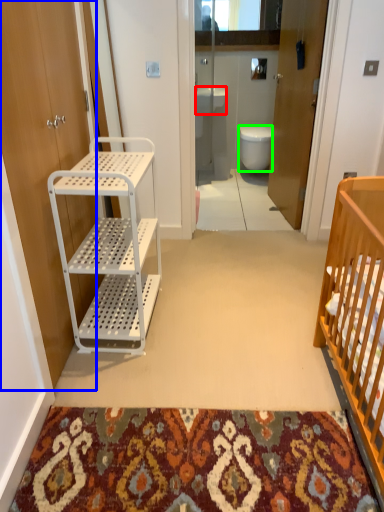
Question: Considering the real-world distances, which object is closest to sink (highlighted by a red box)? door (highlighted by a blue box) or toilet (highlighted by a green box).

Choices:
 (A) door
 (B) toilet

Answer: (B)